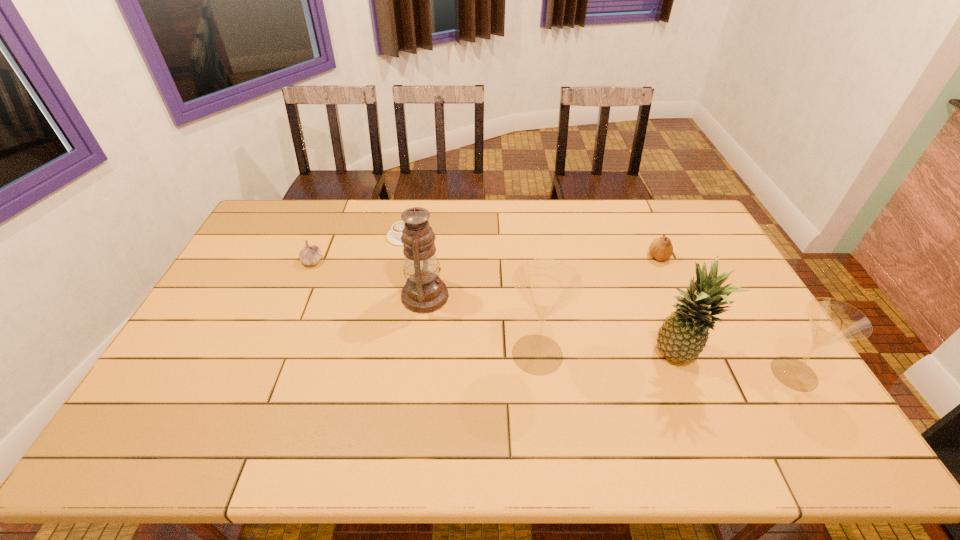
Image resolution: width=960 pixels, height=540 pixels. Find the location of `object at the near edge`. object at the near edge is located at coordinates (832, 321).

Locate an element on the screen. Image resolution: width=960 pixels, height=540 pixels. object that is positioned at the right edge is located at coordinates 832,321.

This screenshot has height=540, width=960. What are the coordinates of `object that is at the near right corner` in the screenshot? It's located at (832, 321).

At what (x,y) coordinates should I click in order to perform the action: click on vacant area at the far edge of the desktop. Please return your answer as a coordinate pair (x, y). This screenshot has width=960, height=540. Looking at the image, I should click on (508, 234).

The height and width of the screenshot is (540, 960). What are the coordinates of `free spot at the near edge of the desktop` in the screenshot? It's located at (669, 381).

Identify the location of blank space at the left edge. This screenshot has height=540, width=960. (238, 261).

At what (x,y) coordinates should I click in order to perform the action: click on vacant area at the far left corner of the desktop. Please return your answer as a coordinate pair (x, y). The image size is (960, 540). Looking at the image, I should click on pos(293,219).

Locate an element on the screen. This screenshot has height=540, width=960. vacant space at the near left corner is located at coordinates (170, 388).

Identify the location of vacant area at the far right corner. (694, 210).

Locate an element on the screen. vacant point located between the pineapple and the oil lamp is located at coordinates (550, 326).